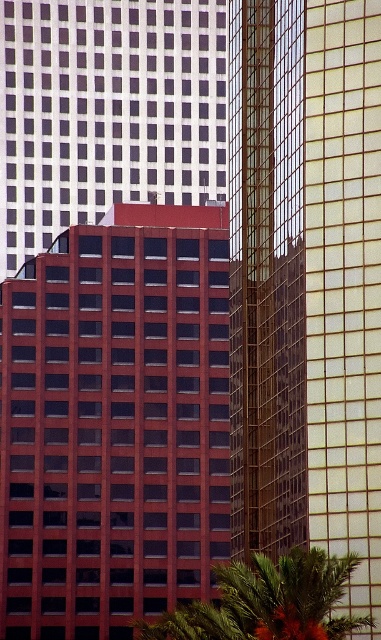
At what (x,y) coordinates should I click in order to perform the action: click on matte glass building at center. Please return your answer as a coordinate pair (x, y). Looking at the image, I should click on (115, 422).